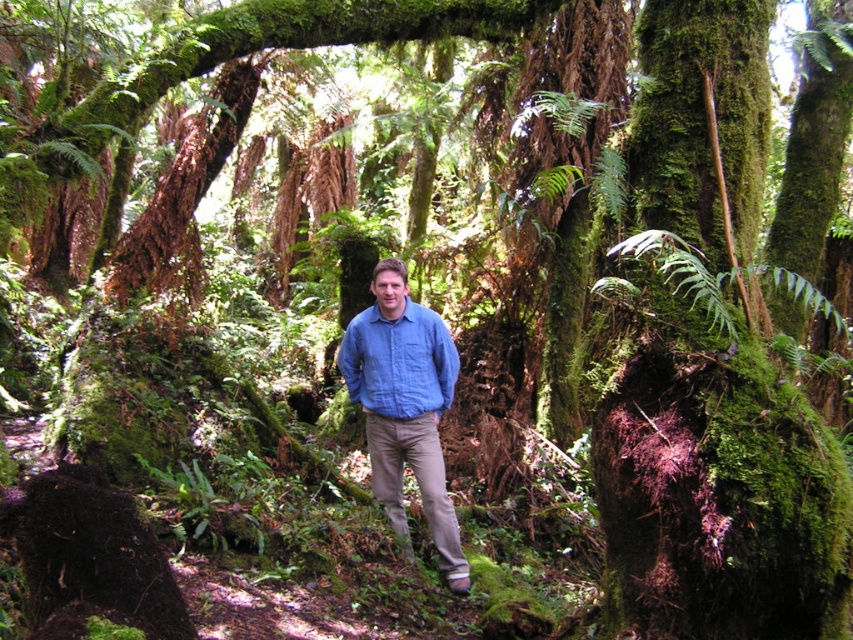
Question: Which of the following is the farthest from the observer?

Choices:
 (A) (421, 324)
 (B) (384, 404)

Answer: (A)

Question: Which of the following is the farthest from the observer?

Choices:
 (A) matte blue shirt at center
 (B) blue cotton shirt at center

Answer: (A)

Question: Among these objects, which one is nearest to the camera?

Choices:
 (A) blue cotton shirt at center
 (B) matte blue shirt at center

Answer: (A)

Question: Does blue cotton shirt at center have a greater width compared to matte blue shirt at center?

Choices:
 (A) yes
 (B) no

Answer: (A)

Question: Where is blue cotton shirt at center located in relation to matte blue shirt at center in the image?

Choices:
 (A) below
 (B) above

Answer: (A)

Question: Does blue cotton shirt at center have a smaller size compared to matte blue shirt at center?

Choices:
 (A) yes
 (B) no

Answer: (B)